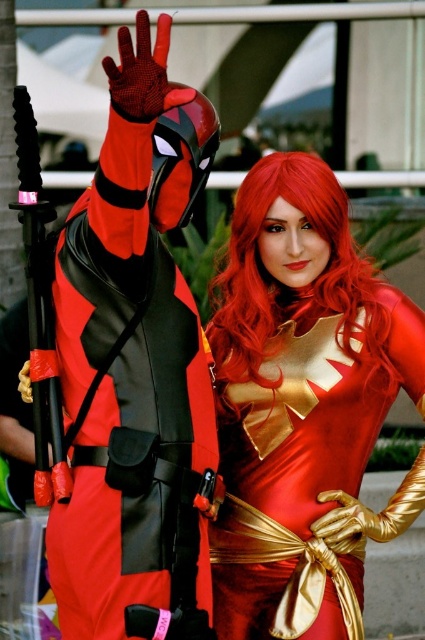
In the scene shown: Does satin gold dress at center have a greater width compared to shiny red wig at center?

Indeed, satin gold dress at center has a greater width compared to shiny red wig at center.

Does satin gold dress at center appear over shiny red wig at center?

No, satin gold dress at center is not above shiny red wig at center.

Image resolution: width=425 pixels, height=640 pixels. What are the coordinates of `satin gold dress at center` in the screenshot? It's located at (303, 404).